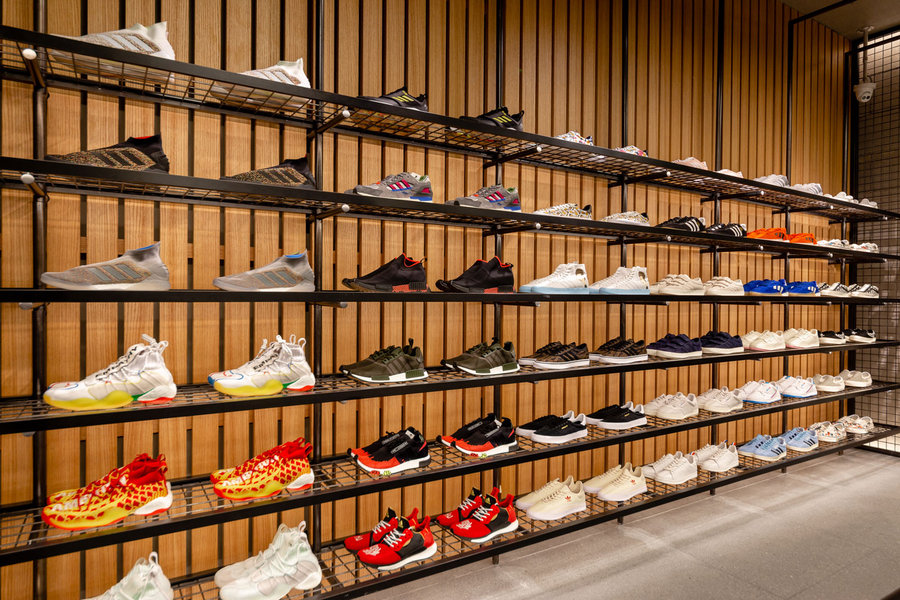
Where is `metal shelves`? The width and height of the screenshot is (900, 600). metal shelves is located at coordinates (570, 518), (549, 452), (537, 373), (528, 297), (536, 217), (551, 142).